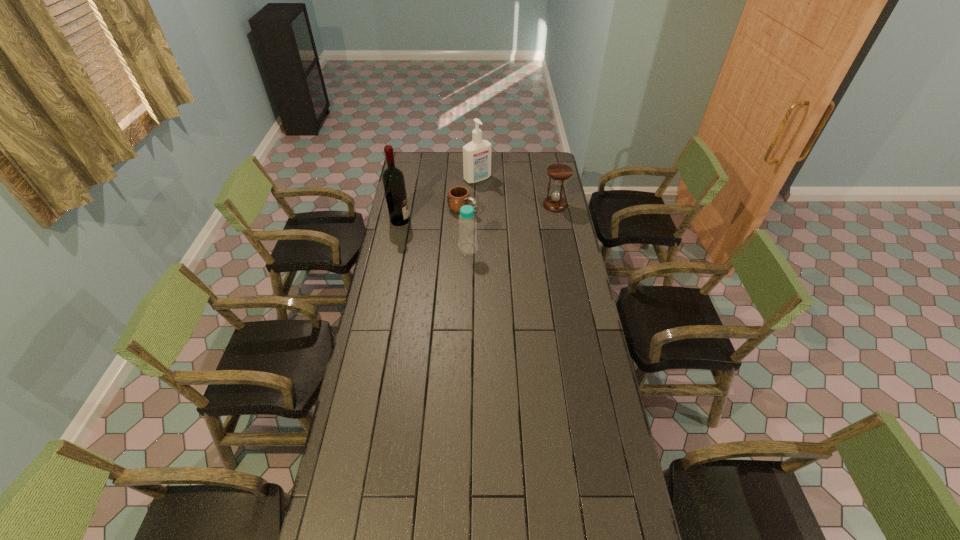
You are a GUI agent. You are given a task and a screenshot of the screen. Output one action in this format:
    pyautogui.click(x=<x>, y=<y>)
    Task: Click on the blank space located on the front label of the second tallest object
    
    Given the screenshot: What is the action you would take?
    pyautogui.click(x=520, y=218)

Find the location of `vacant region located 0.220m on the side of the mug with the handle`. vacant region located 0.220m on the side of the mug with the handle is located at coordinates (508, 232).

At what (x,y) coordinates should I click in order to perform the action: click on vacant position located on the side of the mug with the handle. Please return your answer as a coordinate pair (x, y). The height and width of the screenshot is (540, 960). Looking at the image, I should click on (539, 248).

Locate an element on the screen. The height and width of the screenshot is (540, 960). free region located on the side of the mug with the handle is located at coordinates (484, 220).

Find the location of a particular element. The width and height of the screenshot is (960, 540). vacant area situated on the front and back of the leftmost object is located at coordinates tap(436, 225).

Image resolution: width=960 pixels, height=540 pixels. I want to click on vacant area situated 0.210m on the front and back of the leftmost object, so click(x=449, y=226).

Locate an element on the screen. This screenshot has height=540, width=960. blank space located on the front and back of the leftmost object is located at coordinates coord(461,227).

I want to click on object at the far edge, so click(476, 154).

Image resolution: width=960 pixels, height=540 pixels. Identify the location of object that is at the left edge. (393, 180).

What are the coordinates of `object that is at the right edge` in the screenshot? It's located at (558, 172).